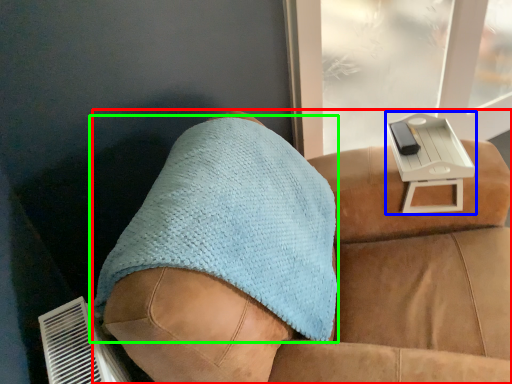
Question: Estimate the real-world distances between objects in this image. Which object is farther from furniture (highlighted by a red box), table (highlighted by a blue box) or throw pillow (highlighted by a green box)?

Choices:
 (A) table
 (B) throw pillow

Answer: (A)